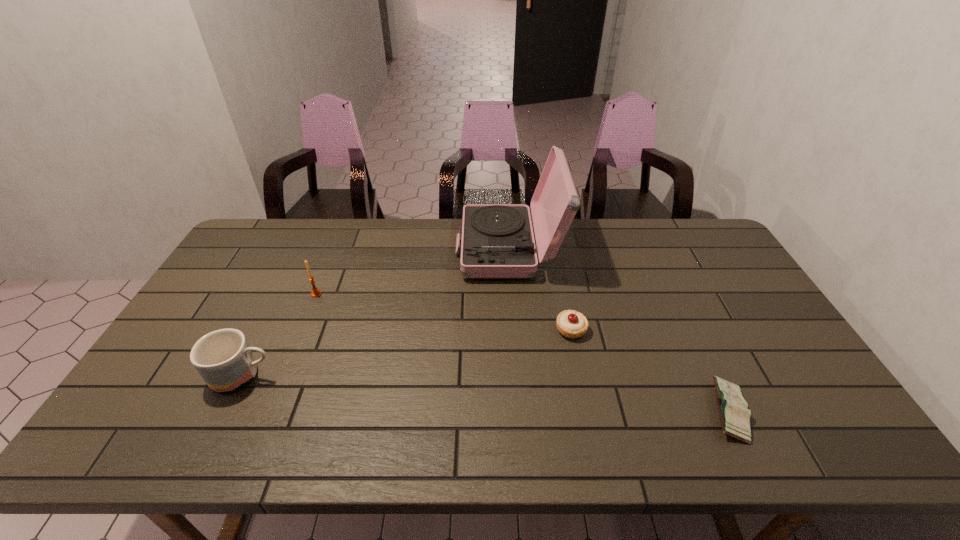
In order to click on vacant position in the image that satisfies the following two spatial constraints: 1. on the side with the handle of the leftmost object; 2. on the back side of the shortest object in this screenshot , I will do [226, 411].

I want to click on vacant space that satisfies the following two spatial constraints: 1. on the back side of the fourth tallest object; 2. with the lid open on the farthest object, so click(554, 249).

This screenshot has height=540, width=960. I want to click on vacant space that satisfies the following two spatial constraints: 1. with the lid open on the pastry; 2. on the left side of the tallest object, so click(x=515, y=329).

Where is `blank area in the image that satisfies the following two spatial constraints: 1. on the front side of the candle_holder; 2. on the side with the handle of the mug`? blank area in the image that satisfies the following two spatial constraints: 1. on the front side of the candle_holder; 2. on the side with the handle of the mug is located at coordinates (282, 376).